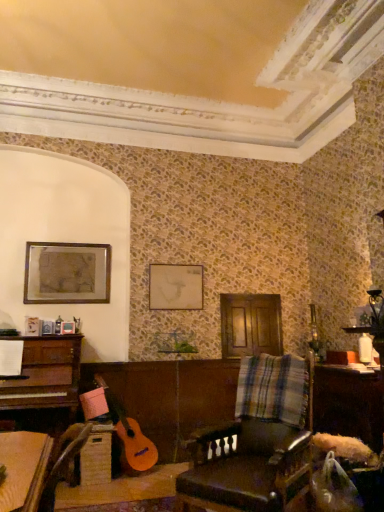
Question: Is matte gold picture frame at upper left, which is the 2th picture frame from right to left, inside or outside of leather at center?

Choices:
 (A) outside
 (B) inside

Answer: (A)

Question: From the image's perspective, relative to leather at center, is matte gold picture frame at upper left, which ranks as the first picture frame in left-to-right order, above or below?

Choices:
 (A) below
 (B) above

Answer: (B)

Question: Estimate the real-world distances between objects in this image. Which object is closer to the wooden table at lower right?

Choices:
 (A) matte gold picture frame at upper left, which ranks as the first picture frame in left-to-right order
 (B) matte white picture frame at center, which ranks as the 2th picture frame in left-to-right order
 (C) leather at center

Answer: (C)

Question: Which is farther from the wooden table at lower right?

Choices:
 (A) matte gold picture frame at upper left, which ranks as the first picture frame in left-to-right order
 (B) matte white picture frame at center, which ranks as the 2th picture frame in left-to-right order
 (C) leather at center

Answer: (A)